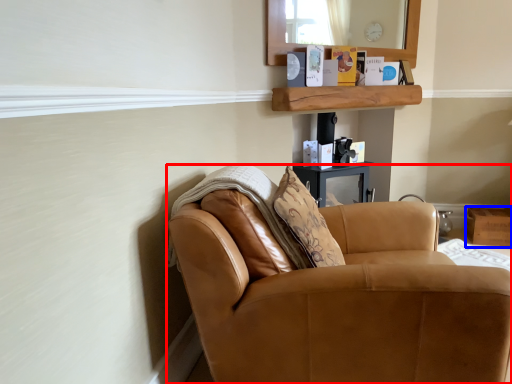
Question: Which of the following is the closest to the observer, chair (highlighted by a red box) or box (highlighted by a blue box)?

Choices:
 (A) chair
 (B) box

Answer: (A)